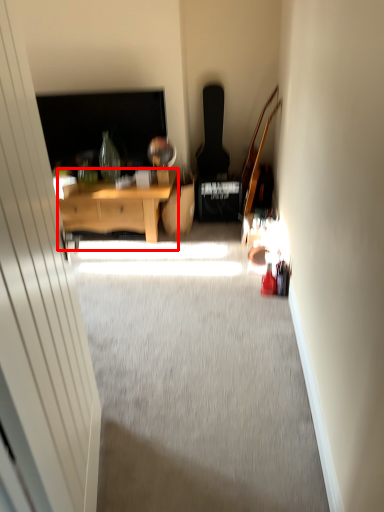
Question: Observing the image, what is the correct spatial positioning of desk (annotated by the red box) in reference to glass door?

Choices:
 (A) left
 (B) right

Answer: (A)